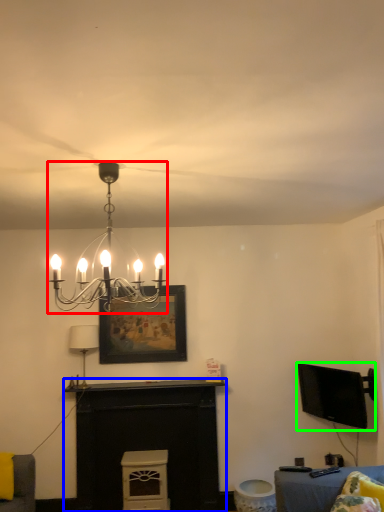
Question: Based on their relative distances, which object is nearer to lamp (highlighted by a red box)? Choose from fireplace (highlighted by a blue box) and television (highlighted by a green box).

Choices:
 (A) fireplace
 (B) television

Answer: (A)